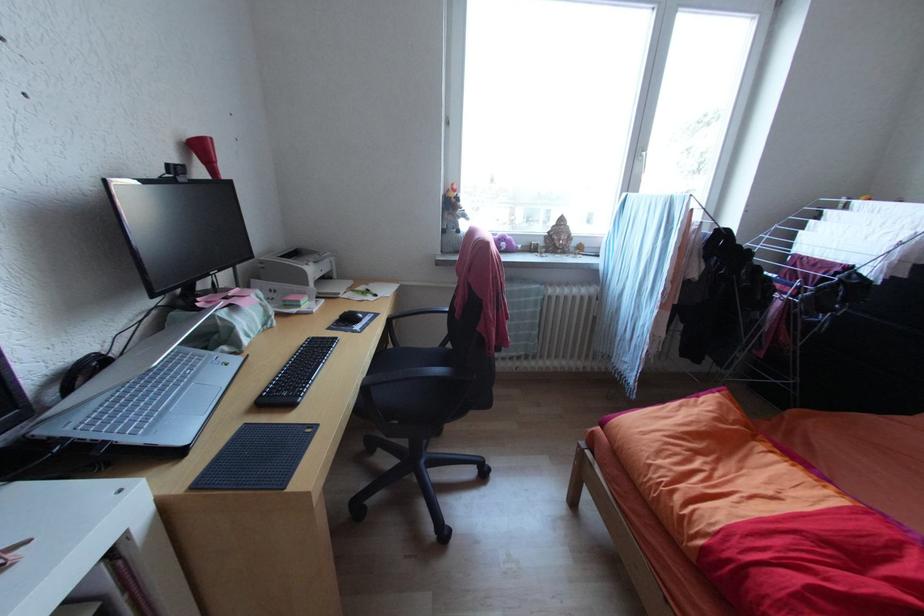
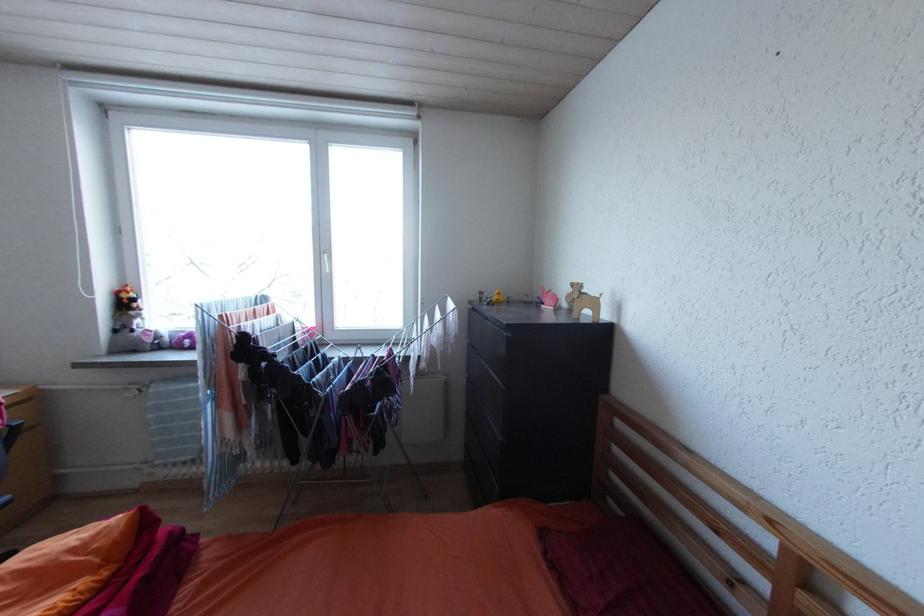
Question: The images are taken continuously from a first-person perspective. In which direction are you moving?

Choices:
 (A) Left
 (B) Right
 (C) Forward
 (D) Backward

Answer: (B)